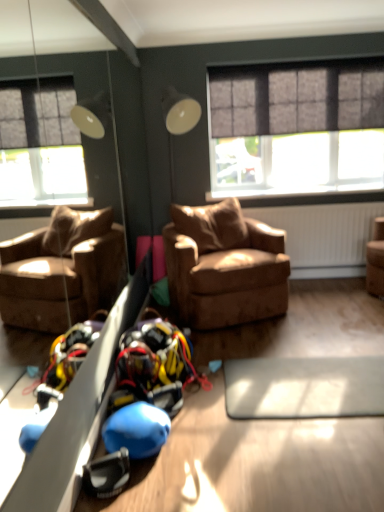
Question: Is matte gray window at upper right positioned in front of dark gray textured curtain at upper center?

Choices:
 (A) yes
 (B) no

Answer: (B)

Question: Is matte gray window at upper right behind dark gray textured curtain at upper center?

Choices:
 (A) no
 (B) yes

Answer: (B)

Question: Is matte gray window at upper right to the left of dark gray textured curtain at upper center from the viewer's perspective?

Choices:
 (A) no
 (B) yes

Answer: (A)

Question: Can you confirm if matte gray window at upper right is wider than dark gray textured curtain at upper center?

Choices:
 (A) yes
 (B) no

Answer: (B)

Question: Is matte gray window at upper right in contact with dark gray textured curtain at upper center?

Choices:
 (A) no
 (B) yes

Answer: (A)

Question: Considering the relative sizes of matte gray window at upper right and dark gray textured curtain at upper center in the image provided, is matte gray window at upper right taller than dark gray textured curtain at upper center?

Choices:
 (A) no
 (B) yes

Answer: (B)

Question: From a real-world perspective, is dark gray textured curtain at upper center on matte gray window at upper right?

Choices:
 (A) no
 (B) yes

Answer: (B)

Question: Is dark gray textured curtain at upper center with matte gray window at upper right?

Choices:
 (A) yes
 (B) no

Answer: (B)

Question: From the image's perspective, does dark gray textured curtain at upper center appear lower than matte gray window at upper right?

Choices:
 (A) yes
 (B) no

Answer: (B)

Question: Is the depth of dark gray textured curtain at upper center greater than that of matte gray window at upper right?

Choices:
 (A) no
 (B) yes

Answer: (A)

Question: Is dark gray textured curtain at upper center thinner than matte gray window at upper right?

Choices:
 (A) yes
 (B) no

Answer: (B)

Question: Can you confirm if dark gray textured curtain at upper center is shorter than matte gray window at upper right?

Choices:
 (A) yes
 (B) no

Answer: (A)

Question: From a real-world perspective, is brown leather armchair at center on top of dark gray textured curtain at upper center?

Choices:
 (A) no
 (B) yes

Answer: (A)